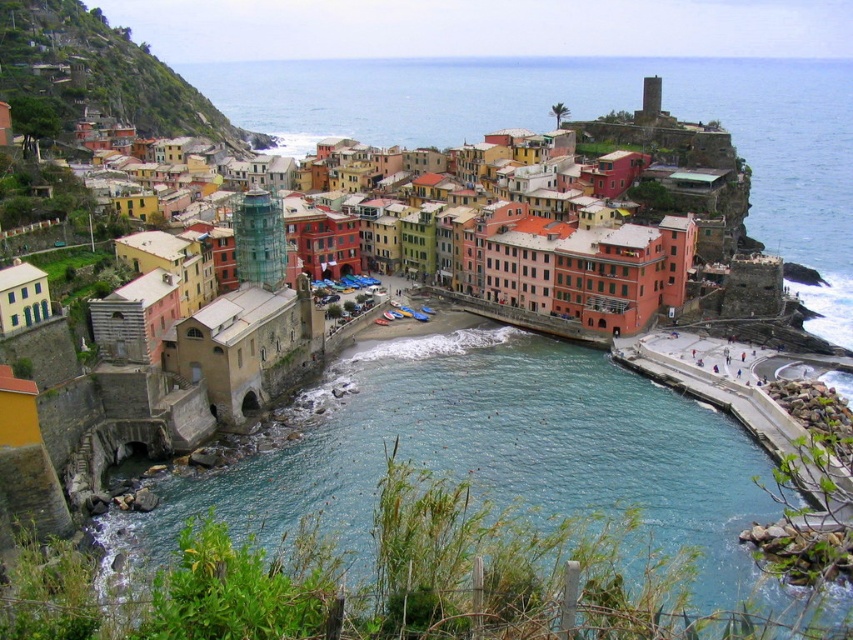
Is multicolored buildings at center further to the viewer compared to multicolored buildings at upper left?

No, it is not.

In the scene shown: Can you confirm if multicolored buildings at center is taller than multicolored buildings at upper left?

No, multicolored buildings at center is not taller than multicolored buildings at upper left.

This screenshot has width=853, height=640. In order to click on multicolored buildings at center in this screenshot , I will do `click(570, 266)`.

The image size is (853, 640). I want to click on multicolored buildings at center, so click(x=570, y=266).

Image resolution: width=853 pixels, height=640 pixels. In order to click on blue water at center in this screenshot , I will do `click(489, 451)`.

Does point (848, 596) come closer to viewer compared to point (567, 332)?

Yes.

The image size is (853, 640). What do you see at coordinates (489, 451) in the screenshot? I see `blue water at center` at bounding box center [489, 451].

Identify the location of blue water at center. The width and height of the screenshot is (853, 640). (489, 451).

Who is lower down, blue water at center or multicolored buildings at upper left?

blue water at center is below.

The height and width of the screenshot is (640, 853). Find the location of `blue water at center`. blue water at center is located at coordinates (489, 451).